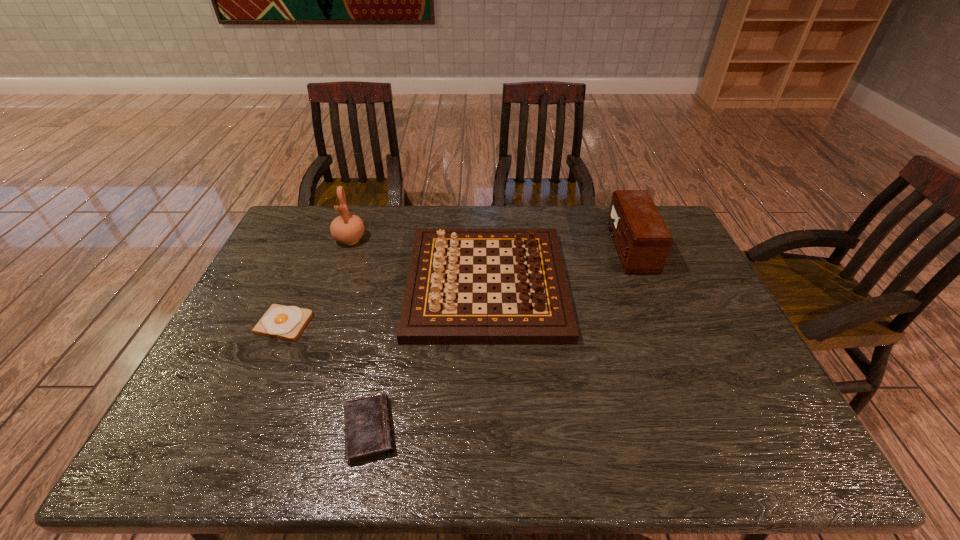
I want to click on free region located 0.130m on the side with the white pieces of the third shortest object, so click(367, 284).

Identify the location of vacant space situated 0.140m on the side with the white pieces of the third shortest object. [x=364, y=284].

You are a GUI agent. You are given a task and a screenshot of the screen. Output one action in this format:
    pyautogui.click(x=<x>, y=<y>)
    Task: Click on the vacant position located on the side with the white pieces of the third shortest object
    
    Given the screenshot: What is the action you would take?
    pyautogui.click(x=350, y=284)

I want to click on blank area located 0.370m on the right of the toast, so click(442, 324).

At what (x,y) coordinates should I click in order to perform the action: click on vacant area situated 0.360m on the back of the nearest object. Please return your answer as a coordinate pair (x, y). Looking at the image, I should click on (396, 295).

I want to click on pottery at the far edge, so pos(347,228).

Locate an element on the screen. This screenshot has width=960, height=540. radio receiver that is positioned at the far edge is located at coordinates (x=642, y=240).

Find the location of a particular element. gameboard located in the far edge section of the desktop is located at coordinates (432, 312).

Where is `object positioned at the near edge`? object positioned at the near edge is located at coordinates (367, 424).

You are a GUI agent. You are given a task and a screenshot of the screen. Output one action in this format:
    pyautogui.click(x=<x>, y=<y>)
    Task: Click on the object at the left edge
    
    Given the screenshot: What is the action you would take?
    pyautogui.click(x=283, y=322)